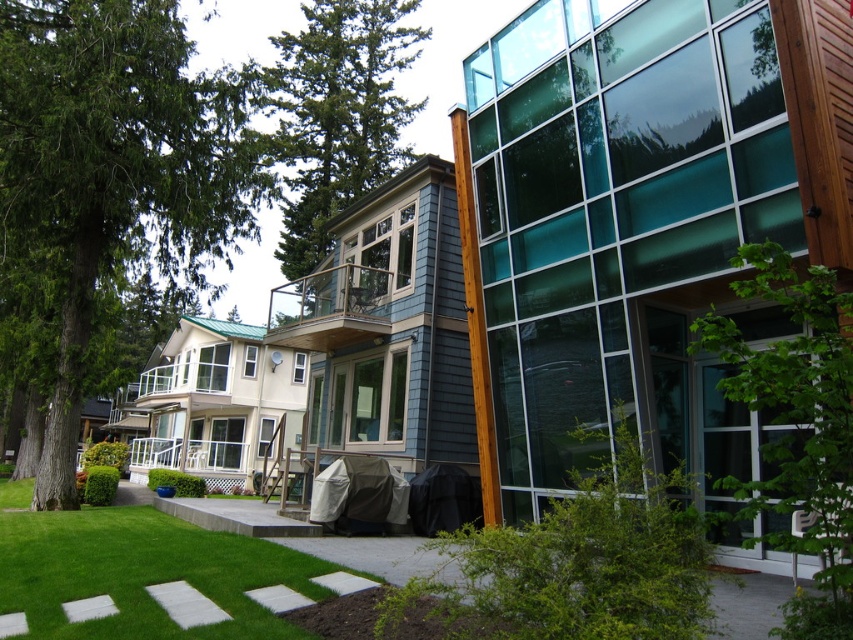
You are an architect designing a new garden layout for this building. You have two trees to place in the courtyard between the two sections of the building. The green leafy tree at center and the green textured tree at upper center. Which tree should you place closer to the glass wall with wooden beams to ensure it doesn

The green leafy tree at center is smaller than the green textured tree at upper center. Therefore, the smaller green leafy tree at center should be placed closer to the glass wall with wooden beams to maintain a balanced appearance and prevent overshadowing the modern facade.

You are standing in front of the modern architectural design and want to water the green leafy bush at lower center. If your watering can has a maximum reach of 2 meters, will you be able to water it without moving closer?

The green leafy bush at lower center is 2.73 meters from the viewer, which is beyond the watering can reach of 2 meters. Therefore, you need to move closer to water it.

Based on the photo, you are a landscape designer planning to add a new pathway between the green leafy bush at lower center and the green textured tree at upper center. Based on their widths, which one should you place closer to the pathway to ensure it doesn

The green leafy bush at lower center has a lesser width compared to the green textured tree at upper center, so it should be placed closer to the pathway to ensure it doesn